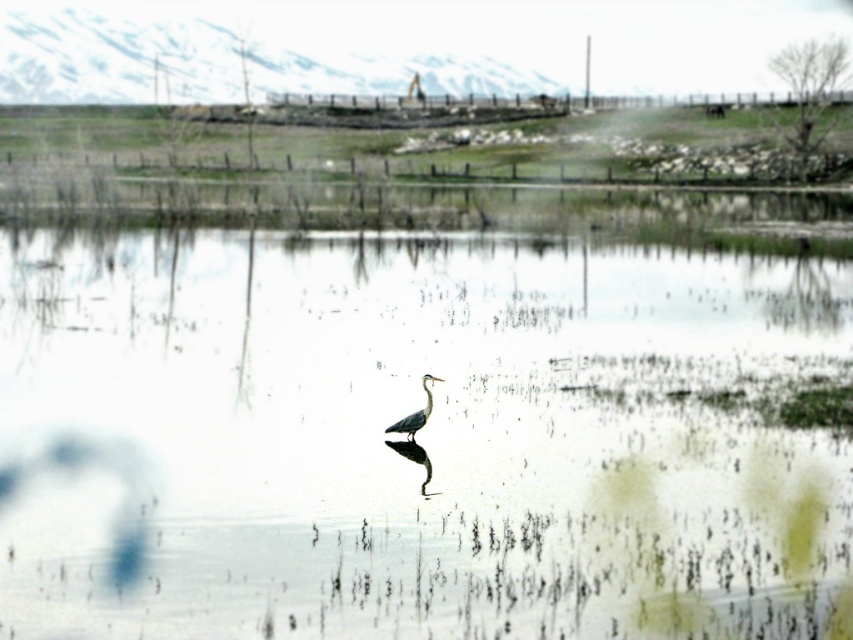
Question: Does clear water at center come behind gray matte bird at center?

Choices:
 (A) no
 (B) yes

Answer: (A)

Question: Which object is closer to the camera taking this photo?

Choices:
 (A) gray matte bird at center
 (B) clear water at center

Answer: (B)

Question: Can you confirm if clear water at center is smaller than gray matte bird at center?

Choices:
 (A) yes
 (B) no

Answer: (B)

Question: Is clear water at center smaller than gray matte bird at center?

Choices:
 (A) yes
 (B) no

Answer: (B)